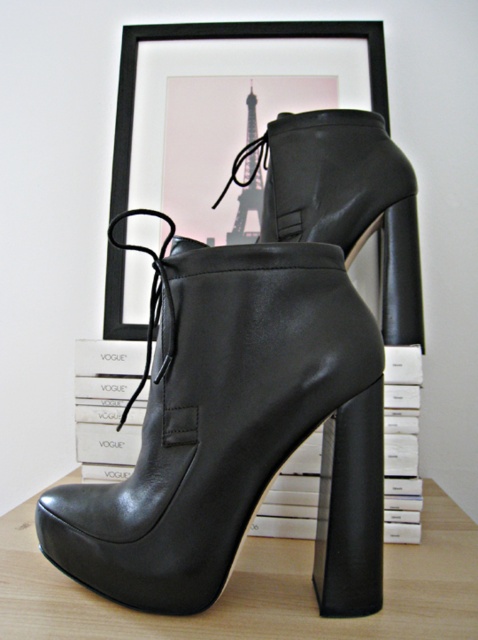
Image resolution: width=478 pixels, height=640 pixels. Describe the element at coordinates (257, 588) in the screenshot. I see `black leather platform boot at lower center` at that location.

Measure the distance between point (430, 534) and camera.

The distance of point (430, 534) from camera is 72.99 centimeters.

Locate an element on the screen. The height and width of the screenshot is (640, 478). black leather platform boot at lower center is located at coordinates (257, 588).

Between point (292, 348) and point (448, 536), which one is positioned behind?

Point (448, 536)

How distant is black leather boot at center from black leather platform boot at lower center?

black leather boot at center and black leather platform boot at lower center are 5.01 inches apart.

Is point (315, 298) farther from camera compared to point (90, 596)?

No.

Where is `black leather boot at center`? black leather boot at center is located at coordinates (236, 432).

Does black leather boot at center lie behind black matte picture frame at upper center?

No, it is not.

Can you confirm if black leather boot at center is thinner than black matte picture frame at upper center?

Indeed, black leather boot at center has a lesser width compared to black matte picture frame at upper center.

Is point (65, 566) behind point (249, 22)?

No, (65, 566) is in front of (249, 22).

Where is `black leather boot at center`? The image size is (478, 640). black leather boot at center is located at coordinates (236, 432).